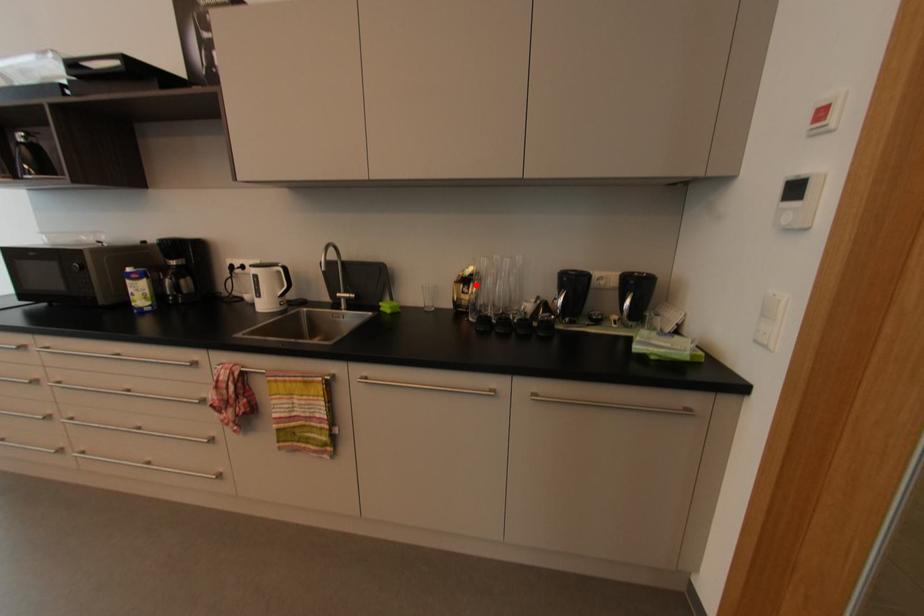
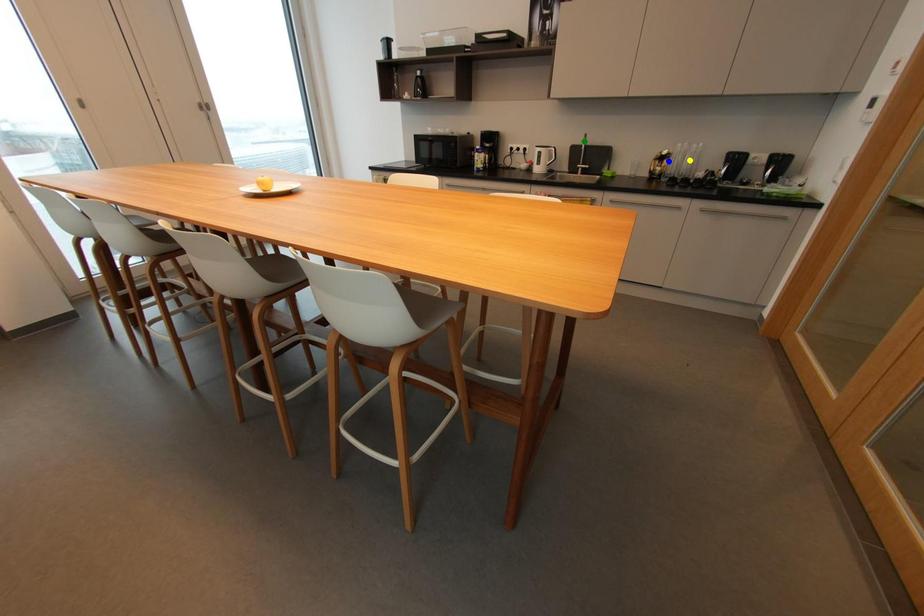
Question: I am providing you with two images of the same scene from different viewpoints. A red point is marked on the first image. You are given multiple points on the second image. Which point in image 2 represents the same 3d spot as the red point in image 1?

Choices:
 (A) blue point
 (B) yellow point
 (C) green point

Answer: (A)